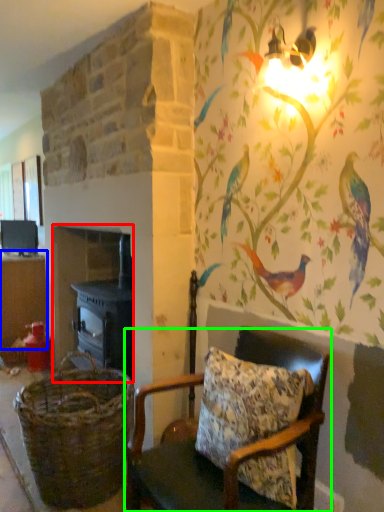
Question: Which is farther away from fireplace (highlighted by a red box)? table (highlighted by a blue box) or chair (highlighted by a green box)?

Choices:
 (A) table
 (B) chair

Answer: (B)